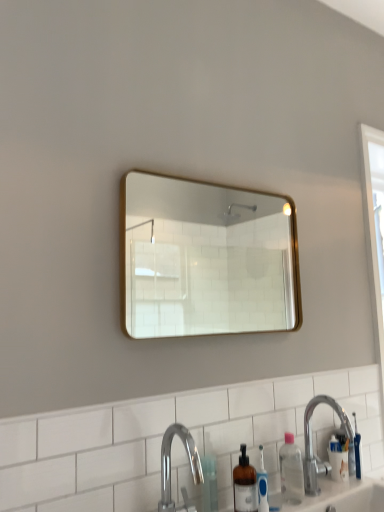
Question: Does silver metallic sink at lower right have a greater height compared to translucent plastic bottle at lower center?

Choices:
 (A) no
 (B) yes

Answer: (B)

Question: Is silver metallic sink at lower right surrounding translucent plastic bottle at lower center?

Choices:
 (A) no
 (B) yes

Answer: (A)

Question: Is silver metallic sink at lower right positioned before translucent plastic bottle at lower center?

Choices:
 (A) no
 (B) yes

Answer: (A)

Question: Is silver metallic sink at lower right positioned behind translucent plastic bottle at lower center?

Choices:
 (A) no
 (B) yes

Answer: (B)

Question: Is silver metallic sink at lower right positioned with its back to translucent plastic bottle at lower center?

Choices:
 (A) no
 (B) yes

Answer: (A)

Question: From a real-world perspective, is clear plastic bottle at lower right positioned above or below polished chrome faucet at lower center?

Choices:
 (A) below
 (B) above

Answer: (A)

Question: Is clear plastic bottle at lower right situated inside polished chrome faucet at lower center or outside?

Choices:
 (A) outside
 (B) inside

Answer: (A)

Question: Considering their positions, is clear plastic bottle at lower right located in front of or behind polished chrome faucet at lower center?

Choices:
 (A) front
 (B) behind

Answer: (B)

Question: From their relative heights in the image, would you say clear plastic bottle at lower right is taller or shorter than polished chrome faucet at lower center?

Choices:
 (A) short
 (B) tall

Answer: (A)

Question: From the image's perspective, is gold-framed mirror at upper center positioned above or below silver metallic sink at lower right?

Choices:
 (A) below
 (B) above

Answer: (B)

Question: Is gold-framed mirror at upper center inside or outside of silver metallic sink at lower right?

Choices:
 (A) inside
 (B) outside

Answer: (B)

Question: Looking at the image, does gold-framed mirror at upper center seem bigger or smaller compared to silver metallic sink at lower right?

Choices:
 (A) big
 (B) small

Answer: (A)

Question: From their relative heights in the image, would you say gold-framed mirror at upper center is taller or shorter than silver metallic sink at lower right?

Choices:
 (A) tall
 (B) short

Answer: (A)

Question: Does point (182, 426) appear closer or farther from the camera than point (377, 317)?

Choices:
 (A) closer
 (B) farther

Answer: (A)

Question: Considering the positions of polished chrome faucet at lower center and white wood screen door at right in the image, is polished chrome faucet at lower center taller or shorter than white wood screen door at right?

Choices:
 (A) tall
 (B) short

Answer: (B)